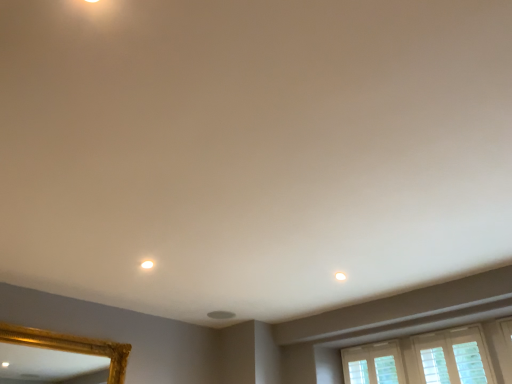
At what (x,y) coordinates should I click in order to perform the action: click on white glossy light fixture at upper center. Please return your answer as a coordinate pair (x, y). Looking at the image, I should click on (147, 264).

Describe the element at coordinates (147, 264) in the screenshot. The height and width of the screenshot is (384, 512). I see `white glossy light fixture at upper center` at that location.

You are a GUI agent. You are given a task and a screenshot of the screen. Output one action in this format:
    pyautogui.click(x=<x>, y=<y>)
    Task: Click on the white matte light at upper center
    The height and width of the screenshot is (384, 512).
    Given the screenshot: What is the action you would take?
    pyautogui.click(x=340, y=276)

In order to face white matte light at upper center, should I rotate leftwards or rightwards?

Turn right by 11.183 degrees to look at white matte light at upper center.

Describe the element at coordinates (340, 276) in the screenshot. Image resolution: width=512 pixels, height=384 pixels. I see `white matte light at upper center` at that location.

At what (x,y) coordinates should I click in order to perform the action: click on white glossy light fixture at upper center. Please return your answer as a coordinate pair (x, y). Looking at the image, I should click on pos(147,264).

Is white matte light at upper center to the left of white glossy light fixture at upper center from the viewer's perspective?

In fact, white matte light at upper center is to the right of white glossy light fixture at upper center.

Is white matte light at upper center in front of or behind white glossy light fixture at upper center in the image?

Clearly, white matte light at upper center is behind white glossy light fixture at upper center.

Which point is more distant from viewer, (337, 278) or (143, 264)?

The point (337, 278) is more distant.

From the image's perspective, which one is positioned higher, white matte light at upper center or white glossy light fixture at upper center?

white glossy light fixture at upper center, from the image's perspective.

From a real-world perspective, is white matte light at upper center positioned above or below white glossy light fixture at upper center?

Clearly, from a real-world perspective, white matte light at upper center is above white glossy light fixture at upper center.

Can you confirm if white matte light at upper center is thinner than white glossy light fixture at upper center?

Result: Indeed, white matte light at upper center has a lesser width compared to white glossy light fixture at upper center.

Which of these two, white matte light at upper center or white glossy light fixture at upper center, stands shorter?

white matte light at upper center is shorter.

Does white matte light at upper center have a smaller size compared to white glossy light fixture at upper center?

Indeed, white matte light at upper center has a smaller size compared to white glossy light fixture at upper center.

Is white matte light at upper center positioned beyond the bounds of white glossy light fixture at upper center?

Yes, white matte light at upper center is located beyond the bounds of white glossy light fixture at upper center.

Is white matte light at upper center with white glossy light fixture at upper center?

They are not placed beside each other.

Does white matte light at upper center turn towards white glossy light fixture at upper center?

No.

Could you measure the distance between white matte light at upper center and white glossy light fixture at upper center?

The distance of white matte light at upper center from white glossy light fixture at upper center is 4.14 feet.

Where is `lighting in front of the white matte light at upper center`? Image resolution: width=512 pixels, height=384 pixels. lighting in front of the white matte light at upper center is located at coordinates (147, 264).

Between white glossy light fixture at upper center and white matte light at upper center, which one appears on the right side from the viewer's perspective?

Positioned to the right is white matte light at upper center.

Relative to white matte light at upper center, is white glossy light fixture at upper center in front or behind?

white glossy light fixture at upper center is positioned closer to the viewer than white matte light at upper center.

Considering the positions of point (145, 267) and point (337, 276), is point (145, 267) closer or farther from the camera than point (337, 276)?

Point (145, 267) is positioned closer to the camera compared to point (337, 276).

From the image's perspective, is white glossy light fixture at upper center located beneath white matte light at upper center?

No, from the image's perspective, white glossy light fixture at upper center is not beneath white matte light at upper center.

Consider the image. From a real-world perspective, does white glossy light fixture at upper center stand above white matte light at upper center?

No.

Can you confirm if white glossy light fixture at upper center is wider than white matte light at upper center?

Yes, white glossy light fixture at upper center is wider than white matte light at upper center.

Considering the relative sizes of white glossy light fixture at upper center and white matte light at upper center in the image provided, is white glossy light fixture at upper center shorter than white matte light at upper center?

No.

Considering the sizes of objects white glossy light fixture at upper center and white matte light at upper center in the image provided, who is smaller, white glossy light fixture at upper center or white matte light at upper center?

white matte light at upper center is smaller.

Could white matte light at upper center be considered to be inside white glossy light fixture at upper center?

No, white matte light at upper center is not inside white glossy light fixture at upper center.

Would you say white glossy light fixture at upper center is a long distance from white matte light at upper center?

Absolutely, white glossy light fixture at upper center is distant from white matte light at upper center.

Is white glossy light fixture at upper center oriented towards white matte light at upper center?

No, white glossy light fixture at upper center is not turned towards white matte light at upper center.

Locate an element on the screen. The width and height of the screenshot is (512, 384). light above the white glossy light fixture at upper center (from a real-world perspective) is located at coordinates (340, 276).

I want to click on lighting in front of the white matte light at upper center, so click(x=147, y=264).

The height and width of the screenshot is (384, 512). Find the location of `lighting on the left of white matte light at upper center`. lighting on the left of white matte light at upper center is located at coordinates (147, 264).